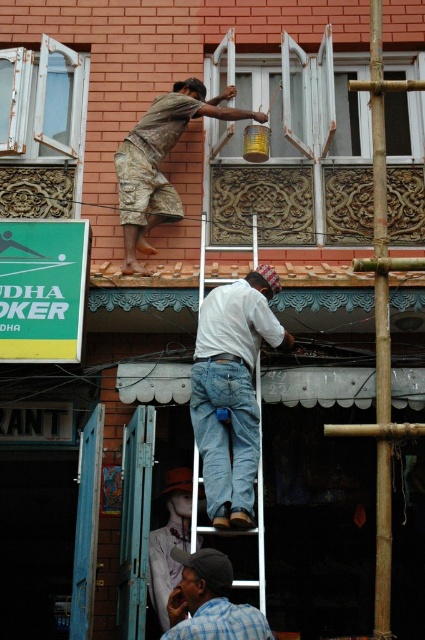
Question: Considering the relative positions of white cotton shirt at center and camouflage shorts at upper center in the image provided, where is white cotton shirt at center located with respect to camouflage shorts at upper center?

Choices:
 (A) left
 (B) right

Answer: (B)

Question: Which point is farther from the camera taking this photo?

Choices:
 (A) (190, 634)
 (B) (153, 106)

Answer: (B)

Question: Can you confirm if white cotton shirt at center is smaller than camouflage shorts at upper center?

Choices:
 (A) yes
 (B) no

Answer: (A)

Question: Does white cotton shirt at center have a greater width compared to camouflage shorts at upper center?

Choices:
 (A) yes
 (B) no

Answer: (B)

Question: Which point appears farthest from the camera in this image?

Choices:
 (A) tap(192, 561)
 (B) tap(195, 86)

Answer: (B)

Question: Which object is farther from the camera taking this photo?

Choices:
 (A) camouflage shorts at upper center
 (B) checkered fabric cap at lower center
 (C) white cotton shirt at center

Answer: (A)